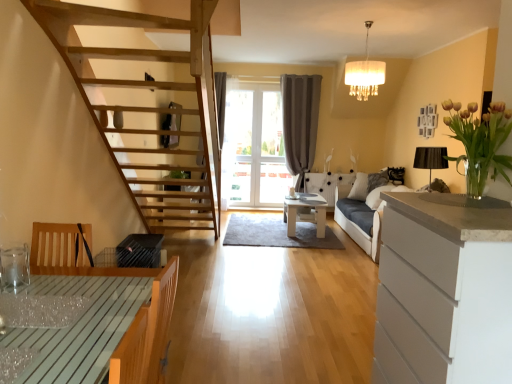
You are a GUI agent. You are given a task and a screenshot of the screen. Output one action in this format:
    pyautogui.click(x=<x>, y=<y>)
    Task: Click on the empty space that is to the right of transparent glass table at lower left
    
    Given the screenshot: What is the action you would take?
    pyautogui.click(x=104, y=314)